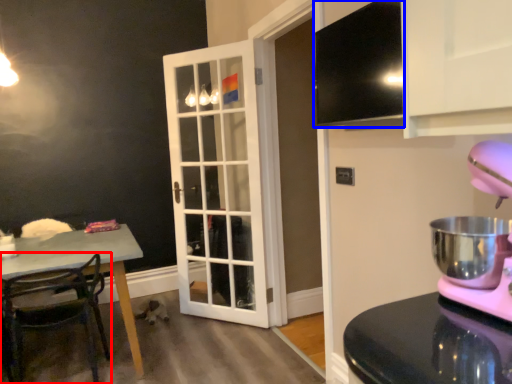
Question: Which object appears farthest to the camera in this image, chair (highlighted by a red box) or exhaust hood (highlighted by a blue box)?

Choices:
 (A) chair
 (B) exhaust hood

Answer: (A)